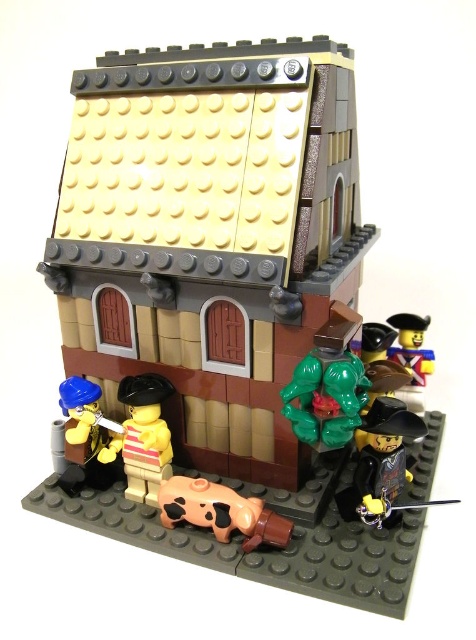
Question: Considering the real-world distances, which object is farthest from the green rubber figure at center?

Choices:
 (A) light tan plastic pirate at center
 (B) brown matte cow at lower center

Answer: (A)

Question: Does smooth yellow minifigure at lower left appear under yellow matte minifigure at upper right?

Choices:
 (A) no
 (B) yes

Answer: (B)

Question: Which object is closer to the camera taking this photo?

Choices:
 (A) yellow matte minifigure at upper right
 (B) smooth yellow minifigure at lower left
 (C) light tan plastic pirate at center
 (D) brown matte cow at lower center

Answer: (D)

Question: Which object is farther from the camera taking this photo?

Choices:
 (A) shiny black sword at lower right
 (B) brown matte cow at lower center
 (C) yellow matte minifigure at upper right

Answer: (C)

Question: Can you confirm if green rubber figure at center is positioned above shiny black sword at lower right?

Choices:
 (A) yes
 (B) no

Answer: (A)

Question: Can you confirm if green rubber figure at center is bigger than brown matte cow at lower center?

Choices:
 (A) yes
 (B) no

Answer: (A)